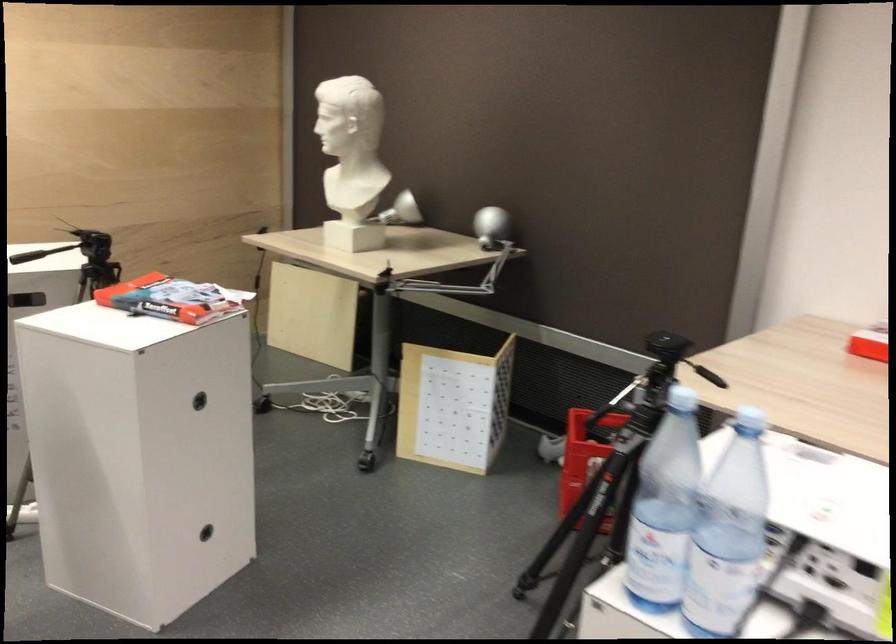
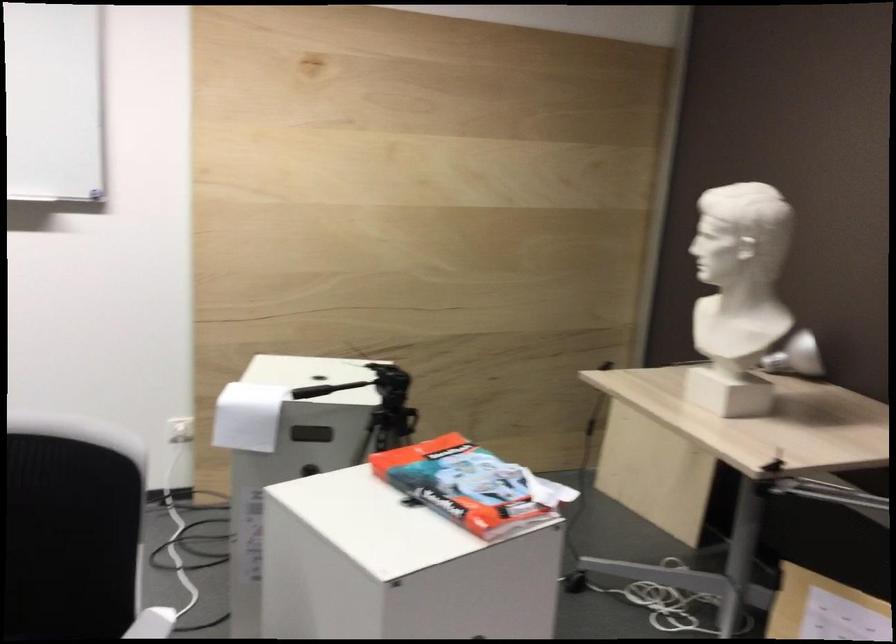
Question: Based on the continuous images, in which direction is the camera rotating? Reply with the corresponding letter.

Choices:
 (A) Left
 (B) Right
 (C) Up
 (D) Down

Answer: (A)